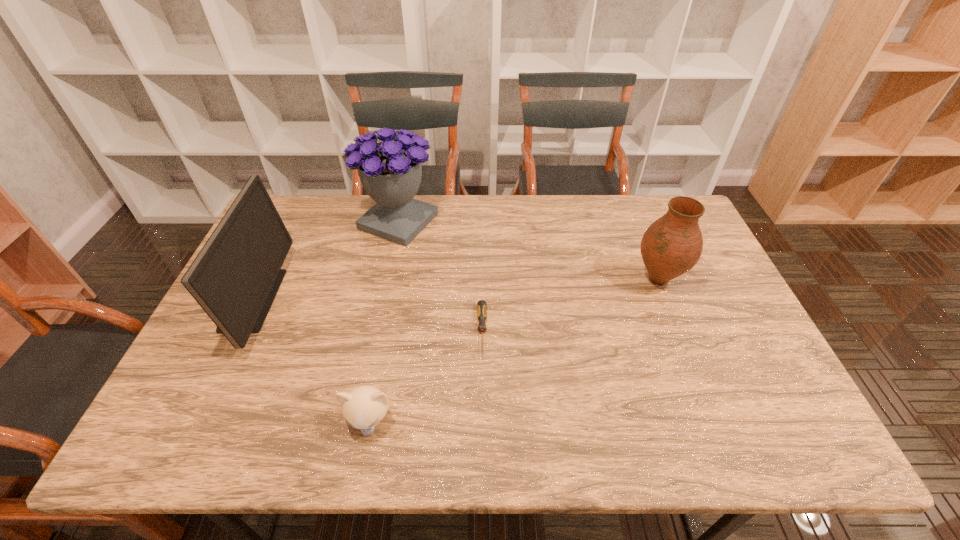
What are the coordinates of `free point between the vase and the leftmost object` in the screenshot? It's located at (454, 289).

Locate which object ranks second in proximity to the fourth object from left to right. Please provide its 2D coordinates. Your answer should be formatted as a tuple, i.e. [(x, y)], where the tuple contains the x and y coordinates of a point satisfying the conditions above.

[(390, 171)]

I want to click on object that is the fourth closest one to the rightmost object, so click(235, 277).

You are a GUI agent. You are given a task and a screenshot of the screen. Output one action in this format:
    pyautogui.click(x=<x>, y=<y>)
    Task: Click on the vacant region that satisfies the following two spatial constraints: 1. on the front side of the farthest object; 2. on the screen side of the leftmost object
    Image resolution: width=960 pixels, height=540 pixels.
    Given the screenshot: What is the action you would take?
    pyautogui.click(x=381, y=300)